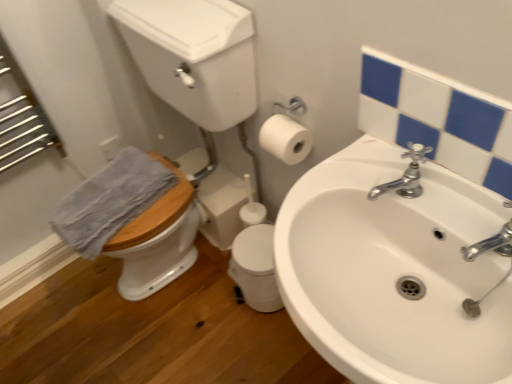
This screenshot has width=512, height=384. Find the location of `blank area to the left of wooden at left`. blank area to the left of wooden at left is located at coordinates (66, 318).